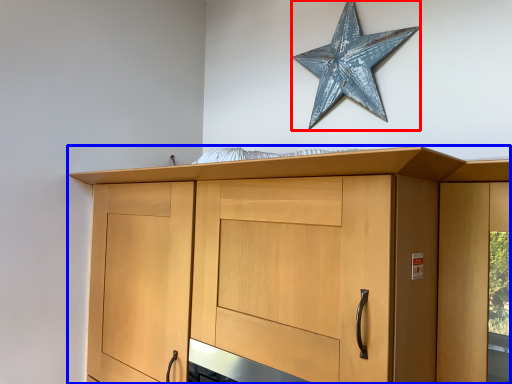
Question: Which object is closer to the camera taking this photo, star (highlighted by a red box) or cupboard (highlighted by a blue box)?

Choices:
 (A) star
 (B) cupboard

Answer: (B)